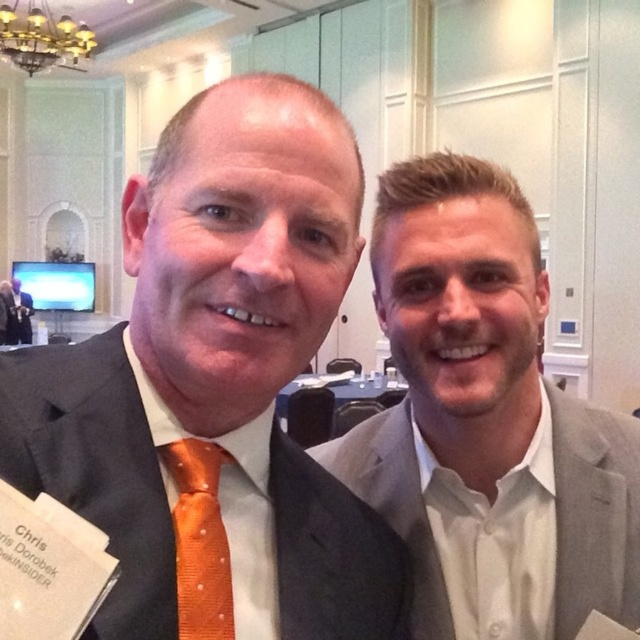
You are a photographer adjusting your camera settings. You notice two orange ties in the frame. The orange silk tie at center and the orange dotted fabric tie at left. Which one is positioned closer to the camera?

The orange silk tie at center is closer to the viewer than the orange dotted fabric tie at left, so the orange silk tie at center is positioned closer to the camera.